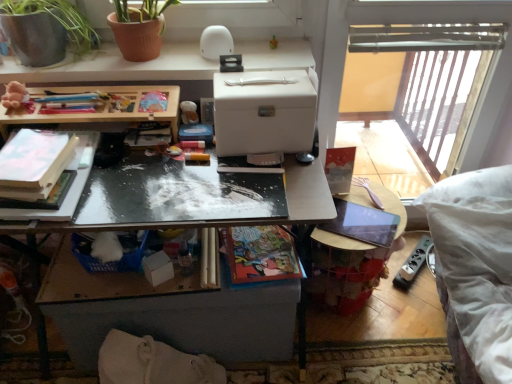
Question: Do you think white matte desk at upper center is within terracotta clay pot at upper left, or outside of it?

Choices:
 (A) outside
 (B) inside

Answer: (A)

Question: In terms of width, does white matte desk at upper center look wider or thinner when compared to terracotta clay pot at upper left?

Choices:
 (A) thin
 (B) wide

Answer: (B)

Question: Which object is the farthest from the matte paper book at center, which is the third book from left to right?

Choices:
 (A) white matte desk at upper center
 (B) terracotta clay pot at upper left
 (C) matte white book at left, the third book positioned from the right
 (D) matte plastic cup at center, the second toy in the front-to-back sequence
 (E) wooden table at center, marked as the 2th table in a top-to-bottom arrangement

Answer: (B)

Question: Based on their relative distances, which object is nearer to the white fabric swivel chair at lower left?

Choices:
 (A) matte plastic cup at center, the first toy positioned from the right
 (B) matte paper book at center, which is the 1th book from right to left
 (C) wooden at upper left, the 1th table from the top
 (D) fluffy beige teddy bear at upper left, the first toy from the left
 (E) terracotta clay pot at upper left

Answer: (B)